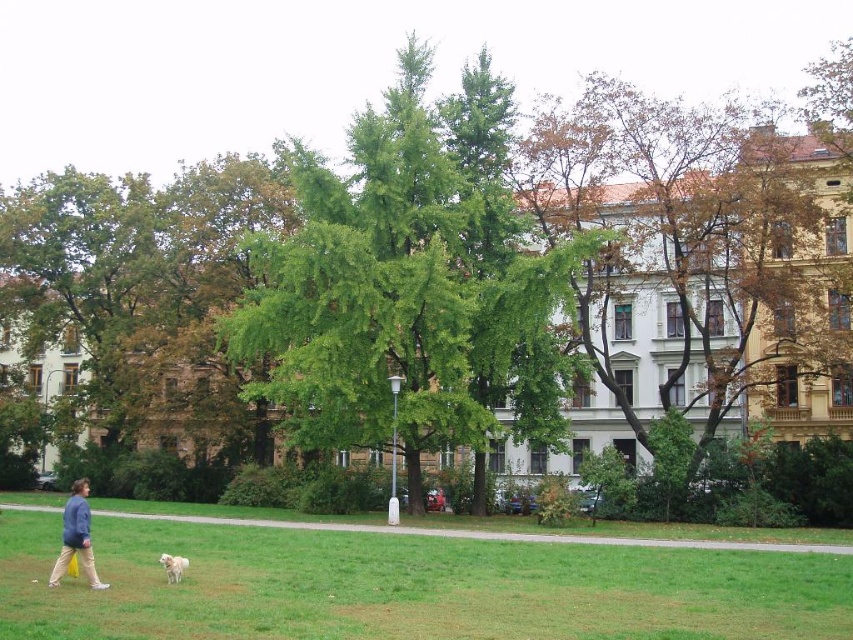
You are a photographer trying to capture a clear shot of the blue denim jacket at lower left and the white fluffy dog at lower left. Since you want both subjects to be in focus, which one should you adjust your camera focus on first to ensure the taller subject is sharp?

The blue denim jacket at lower left is much taller than the white fluffy dog at lower left, so you should focus on the blue denim jacket at lower left first to ensure the taller subject is in sharp focus.

You are a photographer trying to capture both the blue denim jacket at lower left and the white fluffy dog at lower left in a single shot. Based on their sizes, which object should you focus on first to ensure both are in frame?

The blue denim jacket at lower left is larger than the white fluffy dog at lower left, so you should focus on the blue denim jacket at lower left first to ensure both fit in the frame.

You are a photographer trying to capture the white fluffy dog at lower left and the brown textured tree at upper right in the same frame. Which object is wider?

The brown textured tree at upper right is wider than the white fluffy dog at lower left.